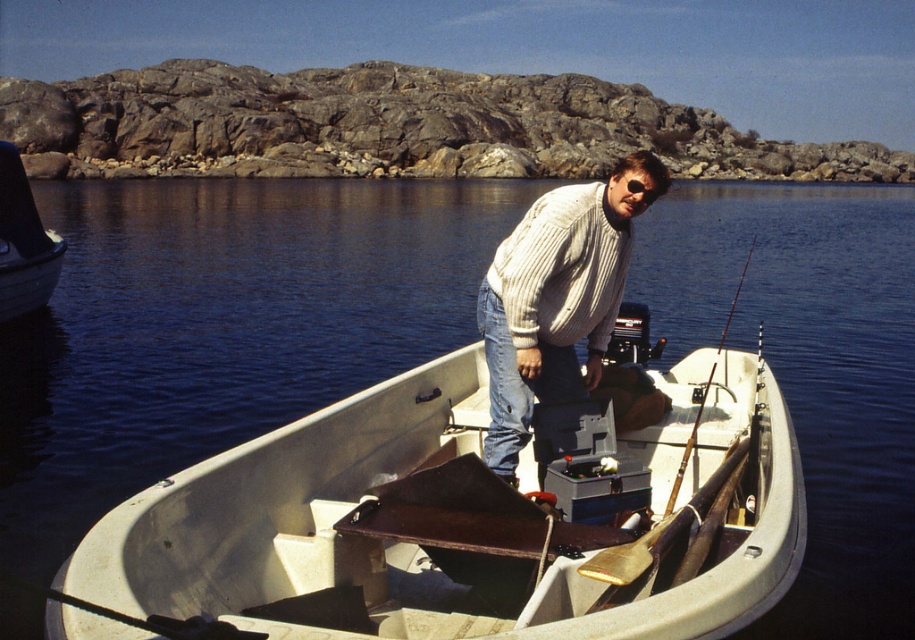
You are trying to determine if the white plastic boat at center can fit through a narrow water passage that is only as wide as the white knitted sweater at center. Based on the scene, can the boat pass through?

The white plastic boat at center might be wider than the white knitted sweater at center, so it may not fit through the passage which is only as wide as the sweater.

In the scene shown: You are a boat inspector who needs to check both the white plastic boat at center and the metallic gray boat at left. Which boat should you approach first if you are coming from the left side of the image?

The metallic gray boat at left is on the left side of the image, so you should approach the metallic gray boat at left first when coming from the left side.

You are a photographer trying to capture the man in the white knitted sweater at center and the metallic gray boat at left. Based on their positions, can you determine which object is closer to the water surface?

The white knitted sweater at center is below metallic gray boat at left, so the sweater is closer to the water surface than the boat.